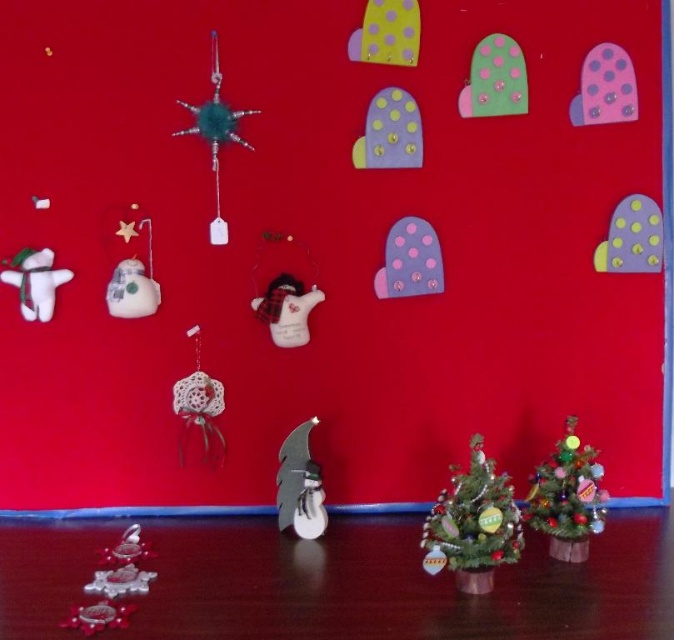
You are standing in front of a festive display with a shiny green Christmas tree at lower right. There is a point marked at coordinates (568, 497). Where is this point located?

The point at (568, 497) is on the shiny green Christmas tree at lower right.

Based on the photo, you are decorating a living room and want to place the shiny green christmas tree at lower right and the teal glitter star at upper left. Considering their sizes, which one should you place first to ensure proper visibility of both?

The shiny green christmas tree at lower right is larger than the teal glitter star at upper left. Therefore, you should place the teal glitter star at upper left first to ensure it doesn not get obscured by the larger tree.

You are planning to wrap a gift for a friend and need to choose between the shiny green christmas tree at lower right and the white plush bear at left. If you want the bigger item to use as a centerpiece, which one should you choose?

The shiny green christmas tree at lower right is larger in size than the white plush bear at left, so you should choose the shiny green christmas tree at lower right as the centerpiece.